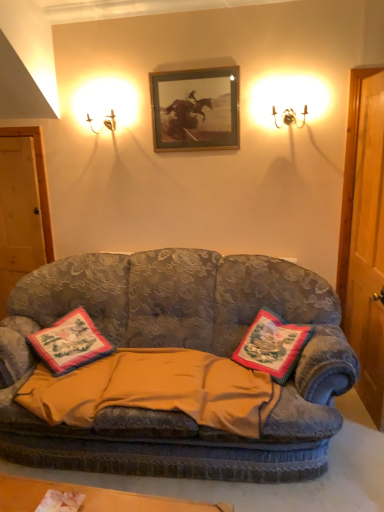
Question: Is embroidered fabric pillow at center, which ranks as the first pillow in right-to-left order, taller than embroidered fabric pillow at center, the first pillow viewed from the left?

Choices:
 (A) no
 (B) yes

Answer: (B)

Question: Are embroidered fabric pillow at center, which ranks as the first pillow in right-to-left order, and embroidered fabric pillow at center, the first pillow viewed from the left, far apart?

Choices:
 (A) yes
 (B) no

Answer: (B)

Question: Is embroidered fabric pillow at center, which ranks as the first pillow in right-to-left order, positioned beyond the bounds of embroidered fabric pillow at center, the 2th pillow viewed from the right?

Choices:
 (A) no
 (B) yes

Answer: (B)

Question: Can you confirm if embroidered fabric pillow at center, the second pillow when ordered from left to right, is positioned to the right of embroidered fabric pillow at center, the first pillow viewed from the left?

Choices:
 (A) no
 (B) yes

Answer: (B)

Question: Is embroidered fabric pillow at center, which ranks as the first pillow in right-to-left order, turned away from embroidered fabric pillow at center, the 2th pillow viewed from the right?

Choices:
 (A) no
 (B) yes

Answer: (A)

Question: Is embroidered fabric pillow at center, the second pillow when ordered from left to right, wider than embroidered fabric pillow at center, the first pillow viewed from the left?

Choices:
 (A) no
 (B) yes

Answer: (A)

Question: Is gold-framed picture at upper center wider than wooden door at left?

Choices:
 (A) no
 (B) yes

Answer: (A)

Question: Does gold-framed picture at upper center appear on the left side of wooden door at left?

Choices:
 (A) no
 (B) yes

Answer: (A)

Question: Is gold-framed picture at upper center far from wooden door at left?

Choices:
 (A) no
 (B) yes

Answer: (B)

Question: Is gold-framed picture at upper center located outside wooden door at left?

Choices:
 (A) no
 (B) yes

Answer: (B)

Question: Considering the relative positions of gold-framed picture at upper center and wooden door at left in the image provided, is gold-framed picture at upper center behind wooden door at left?

Choices:
 (A) yes
 (B) no

Answer: (B)

Question: Can you confirm if gold-framed picture at upper center is bigger than wooden door at left?

Choices:
 (A) no
 (B) yes

Answer: (A)

Question: From the image's perspective, is embroidered fabric pillow at center, the first pillow viewed from the left, on top of gold-framed picture at upper center?

Choices:
 (A) no
 (B) yes

Answer: (A)